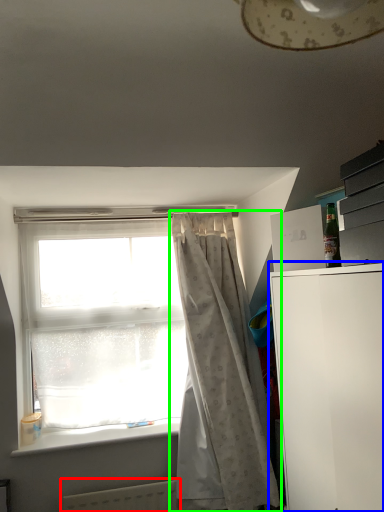
Question: Considering the real-world distances, which object is farthest from radiator (highlighted by a red box)? file cabinet (highlighted by a blue box) or curtain (highlighted by a green box)?

Choices:
 (A) file cabinet
 (B) curtain

Answer: (A)